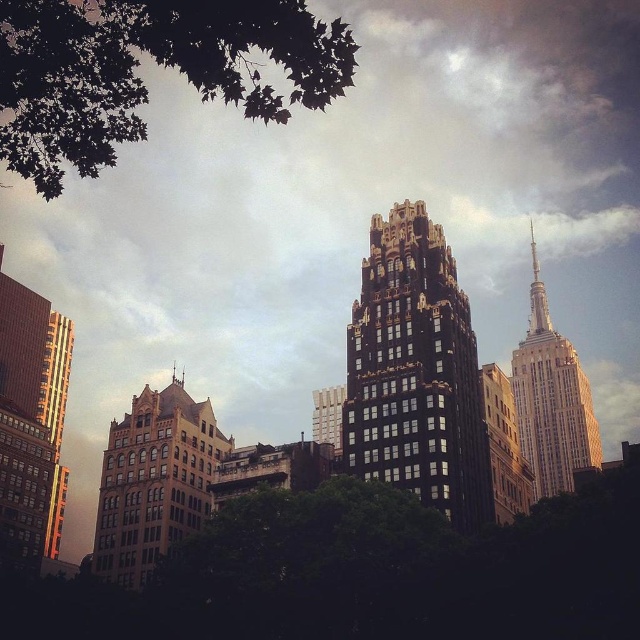
Is green leafy tree at center above white marble tower at upper right?

Incorrect, green leafy tree at center is not positioned above white marble tower at upper right.

Can you confirm if green leafy tree at center is taller than white marble tower at upper right?

No.

Image resolution: width=640 pixels, height=640 pixels. I want to click on green leafy tree at center, so click(368, 573).

From the picture: Is matte brown building at lower left thinner than gold reflective glass skyscraper at left?

Indeed, matte brown building at lower left has a lesser width compared to gold reflective glass skyscraper at left.

Between point (157, 472) and point (20, 433), which one is positioned behind?

Point (20, 433)

Find the location of a particular element. matte brown building at lower left is located at coordinates (154, 481).

Image resolution: width=640 pixels, height=640 pixels. Identify the location of matte brown building at lower left. (154, 481).

Is black textured building at center bigger than gold textured building at center?

Indeed, black textured building at center has a larger size compared to gold textured building at center.

What do you see at coordinates (416, 372) in the screenshot? Image resolution: width=640 pixels, height=640 pixels. I see `black textured building at center` at bounding box center [416, 372].

Identify the location of black textured building at center. This screenshot has width=640, height=640. (416, 372).